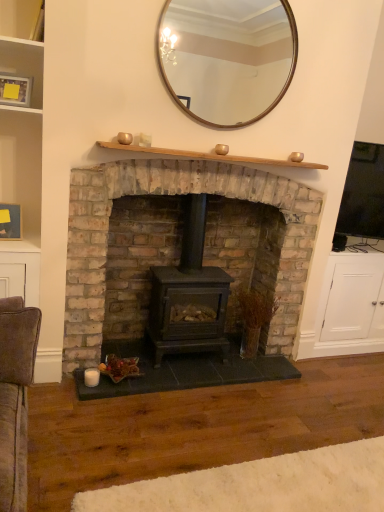
Question: Is matte wooden picture frame at upper left, placed as the 2th picture frame when sorted from bottom to top, positioned beyond the bounds of wooden shelf at upper center?

Choices:
 (A) yes
 (B) no

Answer: (A)

Question: Is the position of matte wooden picture frame at upper left, which is the 1th picture frame in top-to-bottom order, more distant than that of wooden shelf at upper center?

Choices:
 (A) yes
 (B) no

Answer: (A)

Question: Does matte wooden picture frame at upper left, which is the 1th picture frame in top-to-bottom order, have a lesser width compared to wooden shelf at upper center?

Choices:
 (A) no
 (B) yes

Answer: (B)

Question: Is matte wooden picture frame at upper left, arranged as the second picture frame when viewed from the back, closer to the viewer compared to wooden shelf at upper center?

Choices:
 (A) no
 (B) yes

Answer: (A)

Question: Is the surface of matte wooden picture frame at upper left, arranged as the second picture frame when viewed from the back, in direct contact with wooden shelf at upper center?

Choices:
 (A) yes
 (B) no

Answer: (B)

Question: In terms of height, does matte black wood stove at center look taller or shorter compared to wooden shelf at upper center?

Choices:
 (A) short
 (B) tall

Answer: (B)

Question: Which is correct: matte black wood stove at center is inside wooden shelf at upper center, or outside of it?

Choices:
 (A) inside
 (B) outside

Answer: (B)

Question: Looking at their shapes, would you say matte black wood stove at center is wider or thinner than wooden shelf at upper center?

Choices:
 (A) wide
 (B) thin

Answer: (A)

Question: Is matte black wood stove at center in front of or behind wooden shelf at upper center in the image?

Choices:
 (A) front
 (B) behind

Answer: (A)

Question: Looking at their shapes, would you say matte black wood burning stove at center is wider or thinner than wooden picture frame at left, the 1th picture frame ordered from the bottom?

Choices:
 (A) wide
 (B) thin

Answer: (A)

Question: From the image's perspective, relative to wooden picture frame at left, the 1th picture frame ordered from the bottom, is matte black wood burning stove at center above or below?

Choices:
 (A) below
 (B) above

Answer: (A)

Question: From a real-world perspective, is matte black wood burning stove at center positioned above or below wooden picture frame at left, arranged as the 2th picture frame when viewed from the top?

Choices:
 (A) above
 (B) below

Answer: (B)

Question: Is matte black wood burning stove at center situated inside wooden picture frame at left, arranged as the 2th picture frame when viewed from the top, or outside?

Choices:
 (A) outside
 (B) inside

Answer: (A)

Question: Is matte black wood stove at center taller or shorter than wooden picture frame at left, the 1th picture frame ordered from the bottom?

Choices:
 (A) tall
 (B) short

Answer: (A)

Question: Is point (274, 344) closer or farther from the camera than point (13, 212)?

Choices:
 (A) closer
 (B) farther

Answer: (B)